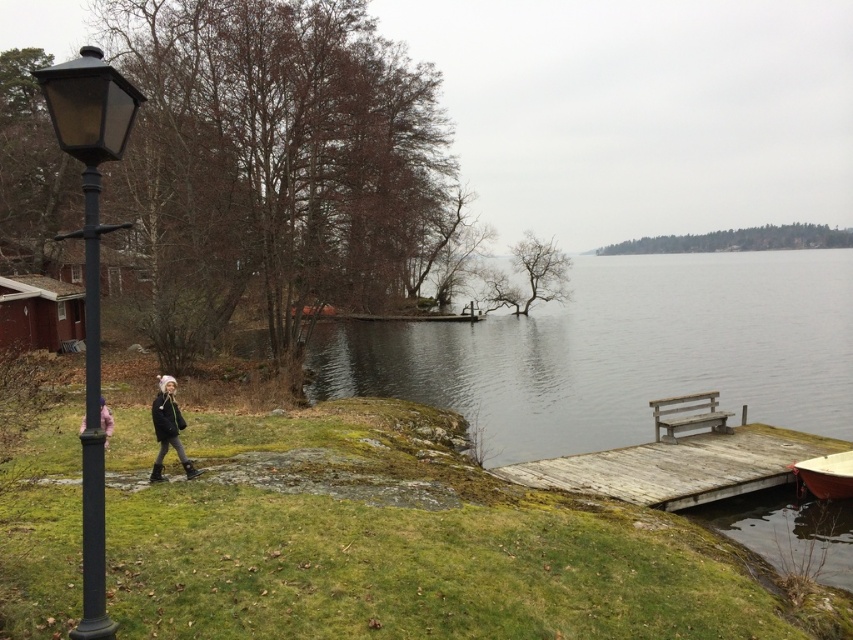
Does black metal lamp post at left have a lesser height compared to pink fabric jacket at lower left?

In fact, black metal lamp post at left may be taller than pink fabric jacket at lower left.

I want to click on black metal lamp post at left, so click(x=91, y=276).

Based on the photo, can you confirm if smooth gray water at center is thinner than black metal lamp post at left?

Incorrect, smooth gray water at center's width is not less than black metal lamp post at left's.

Consider the image. Is smooth gray water at center wider than black metal lamp post at left?

Yes.

Between point (492, 416) and point (80, 106), which one is positioned in front?

Point (80, 106) is in front.

Find the location of a particular element. The width and height of the screenshot is (853, 640). smooth gray water at center is located at coordinates (621, 352).

Can you confirm if wooden bench at lower right is wider than dark gray knit hat at lower left?

No, wooden bench at lower right is not wider than dark gray knit hat at lower left.

Does wooden bench at lower right have a larger size compared to dark gray knit hat at lower left?

Actually, wooden bench at lower right might be smaller than dark gray knit hat at lower left.

What do you see at coordinates (688, 413) in the screenshot?
I see `wooden bench at lower right` at bounding box center [688, 413].

Identify the location of wooden bench at lower right. The height and width of the screenshot is (640, 853). (688, 413).